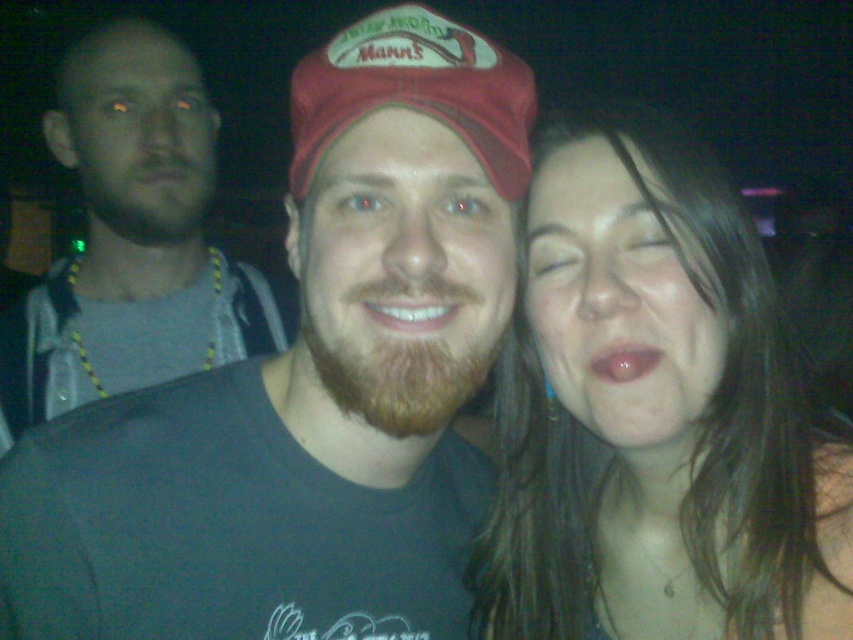
Who is taller, matte skin face at upper left or brown fuzzy beard at center?

Standing taller between the two is matte skin face at upper left.

Is point (149, 157) positioned behind point (339, 381)?

Yes, it is.

Which is in front, point (148, 180) or point (462, 362)?

Point (462, 362) is in front.

Locate an element on the screen. The width and height of the screenshot is (853, 640). matte skin face at upper left is located at coordinates (136, 134).

What do you see at coordinates (131, 237) in the screenshot? I see `gray fabric shirt at left` at bounding box center [131, 237].

The height and width of the screenshot is (640, 853). What are the coordinates of `gray fabric shirt at left` in the screenshot? It's located at pyautogui.click(x=131, y=237).

Who is lower down, smooth skin face at center or brown matte beard at center?

smooth skin face at center is lower down.

Locate an element on the screen. smooth skin face at center is located at coordinates (654, 413).